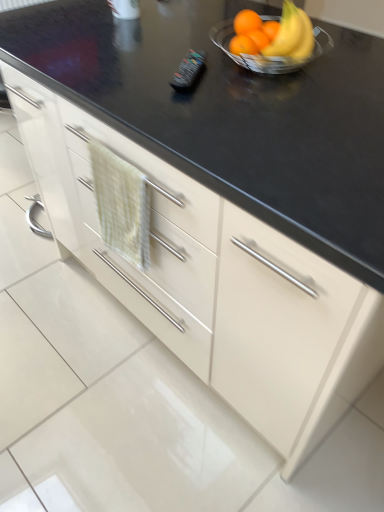
Identify the location of vacant space situated on the left part of clear glass bowl at upper right. coord(171,56).